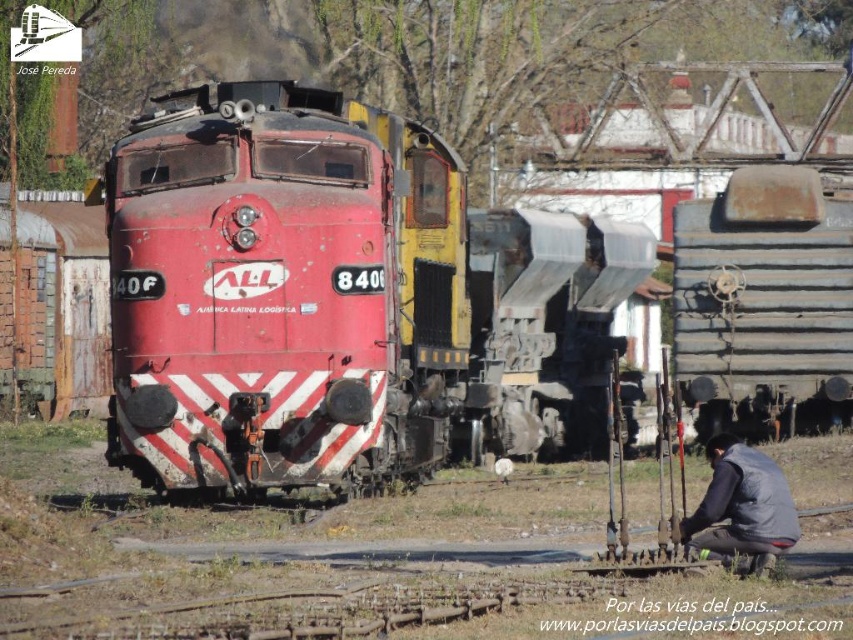
Question: Can you confirm if matte red locomotive at center is thinner than rusty metal train car at center?

Choices:
 (A) no
 (B) yes

Answer: (B)

Question: Does rusty metal train car at right appear on the left side of gray fabric squat at lower right?

Choices:
 (A) no
 (B) yes

Answer: (A)

Question: Which object appears farthest from the camera in this image?

Choices:
 (A) matte red locomotive at center
 (B) rusty metal train car at center
 (C) gray fabric squat at lower right

Answer: (B)

Question: Which of the following is the closest to the observer?

Choices:
 (A) (496, 416)
 (B) (252, 173)
 (C) (721, 474)
 (D) (788, 188)

Answer: (C)

Question: Does rusty metal train car at right appear on the right side of gray fabric squat at lower right?

Choices:
 (A) yes
 (B) no

Answer: (A)

Question: Which point appears farthest from the camera in this image?

Choices:
 (A) (407, 422)
 (B) (718, 232)
 (C) (577, 362)
 (D) (686, 528)

Answer: (C)